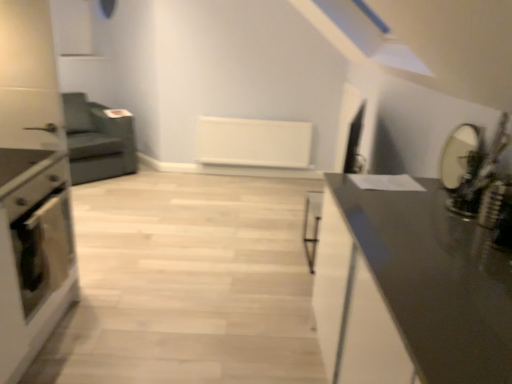
Question: Is dark gray fabric armchair at left facing away from white matte radiator at center?

Choices:
 (A) yes
 (B) no

Answer: (B)

Question: Does dark gray fabric armchair at left contain white matte radiator at center?

Choices:
 (A) yes
 (B) no

Answer: (B)

Question: Considering the relative sizes of dark gray fabric armchair at left and white matte radiator at center in the image provided, is dark gray fabric armchair at left bigger than white matte radiator at center?

Choices:
 (A) no
 (B) yes

Answer: (B)

Question: Does dark gray fabric armchair at left touch white matte radiator at center?

Choices:
 (A) yes
 (B) no

Answer: (B)

Question: Considering the relative sizes of dark gray fabric armchair at left and white matte radiator at center in the image provided, is dark gray fabric armchair at left taller than white matte radiator at center?

Choices:
 (A) no
 (B) yes

Answer: (B)

Question: Is dark gray fabric armchair at left shorter than white matte radiator at center?

Choices:
 (A) yes
 (B) no

Answer: (B)

Question: Is white matte radiator at center to the left of matte black mirror at right from the viewer's perspective?

Choices:
 (A) no
 (B) yes

Answer: (B)

Question: Considering the relative positions of white matte radiator at center and matte black mirror at right in the image provided, is white matte radiator at center behind matte black mirror at right?

Choices:
 (A) yes
 (B) no

Answer: (A)

Question: Are white matte radiator at center and matte black mirror at right far apart?

Choices:
 (A) yes
 (B) no

Answer: (A)

Question: From the image's perspective, does white matte radiator at center appear lower than matte black mirror at right?

Choices:
 (A) no
 (B) yes

Answer: (A)

Question: Is white matte radiator at center completely or partially outside of matte black mirror at right?

Choices:
 (A) no
 (B) yes

Answer: (B)

Question: Does white matte radiator at center turn towards matte black mirror at right?

Choices:
 (A) yes
 (B) no

Answer: (A)

Question: Is the depth of matte black oven at left less than that of matte black oven at left?

Choices:
 (A) yes
 (B) no

Answer: (B)